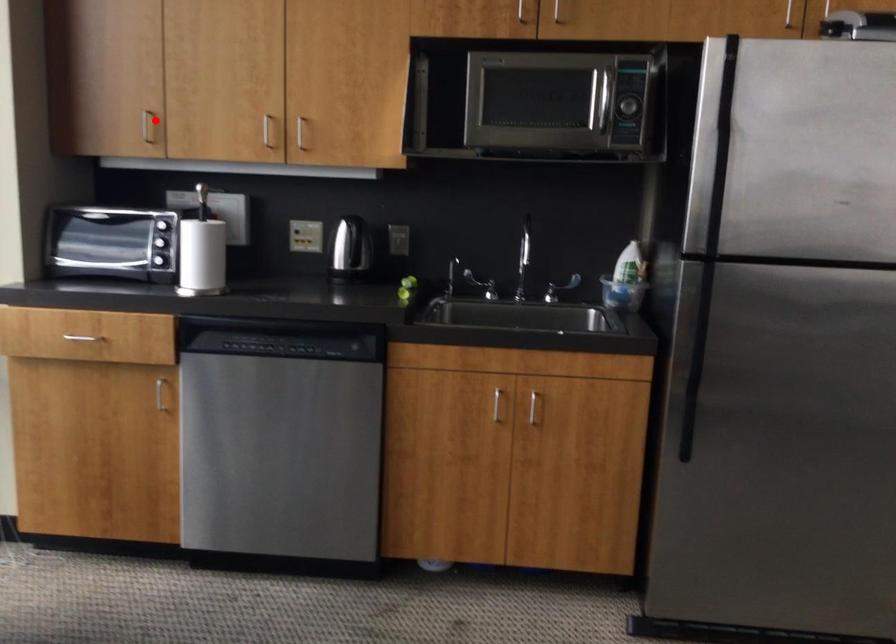
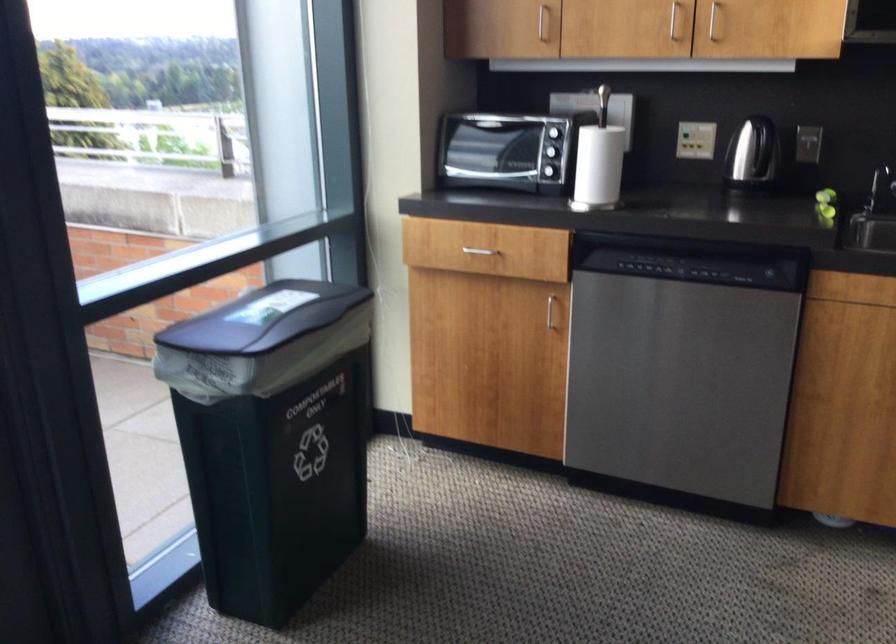
Find the pixel in the second image that matches the highlighted location in the first image.

(543, 23)